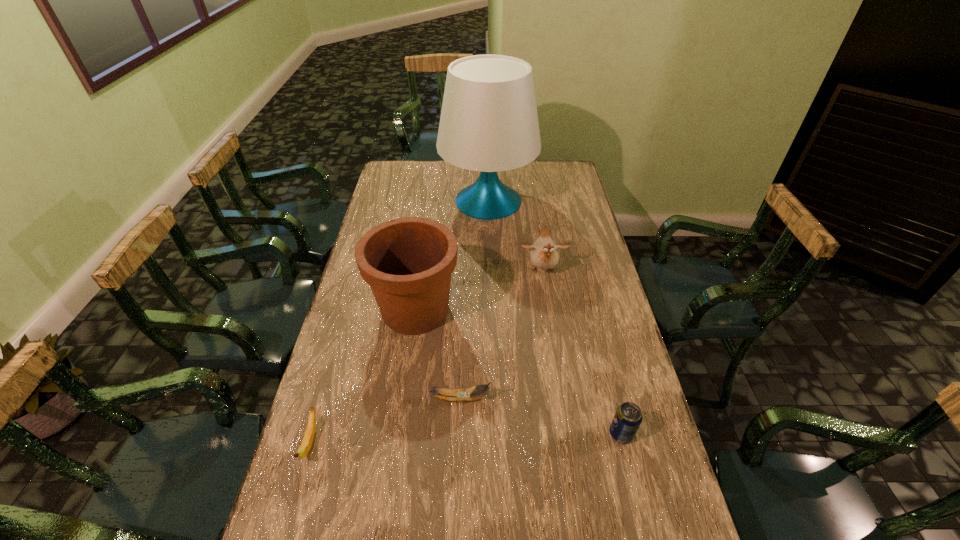
Find the location of a particular element. This screenshot has width=960, height=540. vacant space located 0.180m on the front-facing side of the tallest object is located at coordinates (399, 201).

Where is `vacant space located 0.280m on the front-facing side of the tallest object`? The image size is (960, 540). vacant space located 0.280m on the front-facing side of the tallest object is located at coordinates (377, 201).

Find the location of a particular element. free region located on the front of the flowerpot is located at coordinates (397, 437).

Locate an element on the screen. vacant region located at the beak of the bird is located at coordinates (546, 295).

I want to click on free point located 0.220m on the left of the soda, so click(x=525, y=434).

Where is `free point located at the stem of the right banana`? The height and width of the screenshot is (540, 960). free point located at the stem of the right banana is located at coordinates (588, 399).

At what (x,y) coordinates should I click in order to perform the action: click on vacant space located 0.100m at the stem of the shorter banana. Please return your answer as a coordinate pair (x, y). The height and width of the screenshot is (540, 960). Looking at the image, I should click on (290, 512).

Image resolution: width=960 pixels, height=540 pixels. I want to click on object present at the far edge, so click(489, 122).

At what (x,y) coordinates should I click in order to perform the action: click on flowerpot located at the left edge. Please return your answer as a coordinate pair (x, y). Looking at the image, I should click on (408, 262).

Where is `banana at the left edge`? This screenshot has height=540, width=960. banana at the left edge is located at coordinates (306, 444).